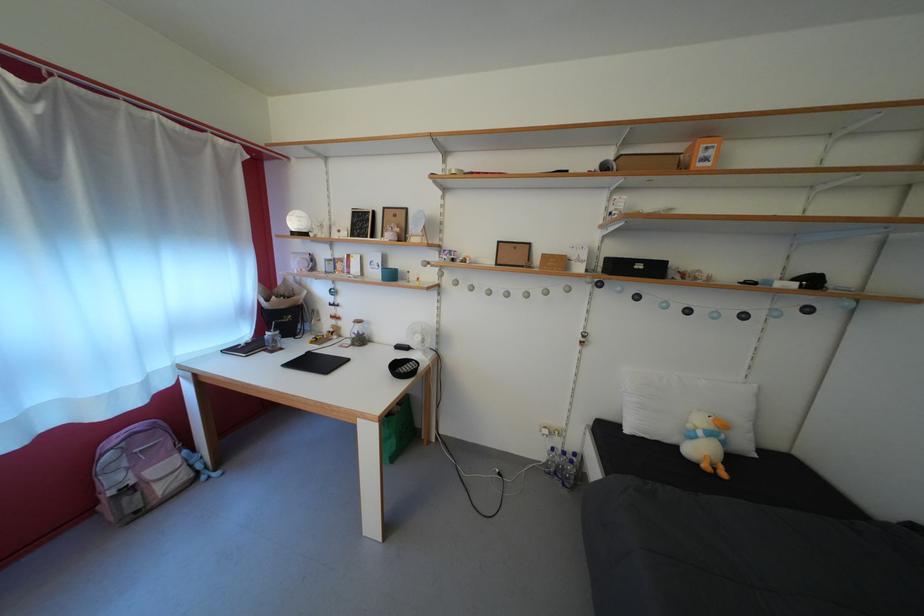
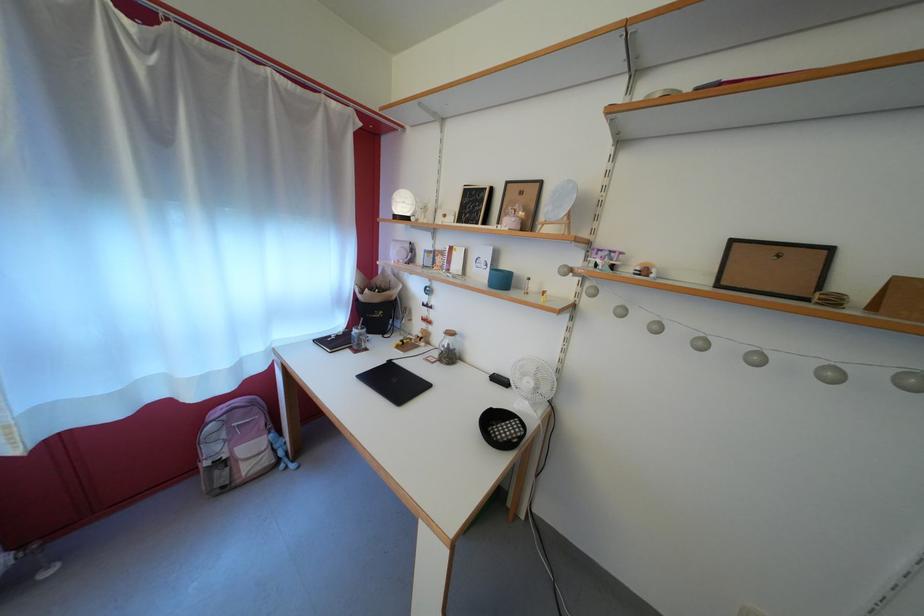
Question: The camera is either moving clockwise (left) or counter-clockwise (right) around the object. The first image is from the beginning of the video and the second image is from the end. Is the camera moving left or right when shooting the video?

Choices:
 (A) Left
 (B) Right

Answer: (B)